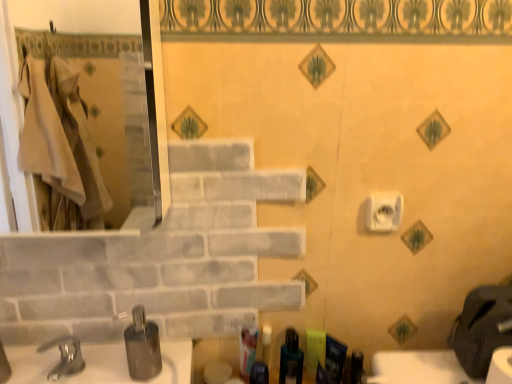
Question: Is matte green soap dispenser at center, which is the second toiletry in right-to-left order, taller or shorter than translucent plastic toothbrush at lower center, the 4th toiletry viewed from the right?

Choices:
 (A) short
 (B) tall

Answer: (A)

Question: Based on their positions, is matte green soap dispenser at center, placed as the 5th toiletry when sorted from left to right, located to the left or right of translucent plastic toothbrush at lower center, the 4th toiletry viewed from the right?

Choices:
 (A) left
 (B) right

Answer: (B)

Question: Considering the real-world distances, which object is closest to the white matte toilet paper at center right?

Choices:
 (A) white glossy toothpaste tube at center, the 1th toiletry from the left
 (B) matte glass mirror at left
 (C) matte green soap dispenser at center, which is the second toiletry in right-to-left order
 (D) translucent plastic toothbrush at lower center, the third toiletry positioned from the right
 (E) shiny dark blue bottle at center, which is the second toiletry from left to right

Answer: (C)

Question: Based on their relative distances, which object is nearer to the blue matte toothpaste tube at lower right, which is the 1th toiletry from right to left?

Choices:
 (A) silver metallic faucet at lower left
 (B) matte green soap dispenser at center, which is the second toiletry in right-to-left order
 (C) shiny dark blue bottle at center, the fifth toiletry positioned from the right
 (D) matte glass mirror at left
 (E) white glossy toothpaste tube at center, the sixth toiletry in the right-to-left sequence

Answer: (B)